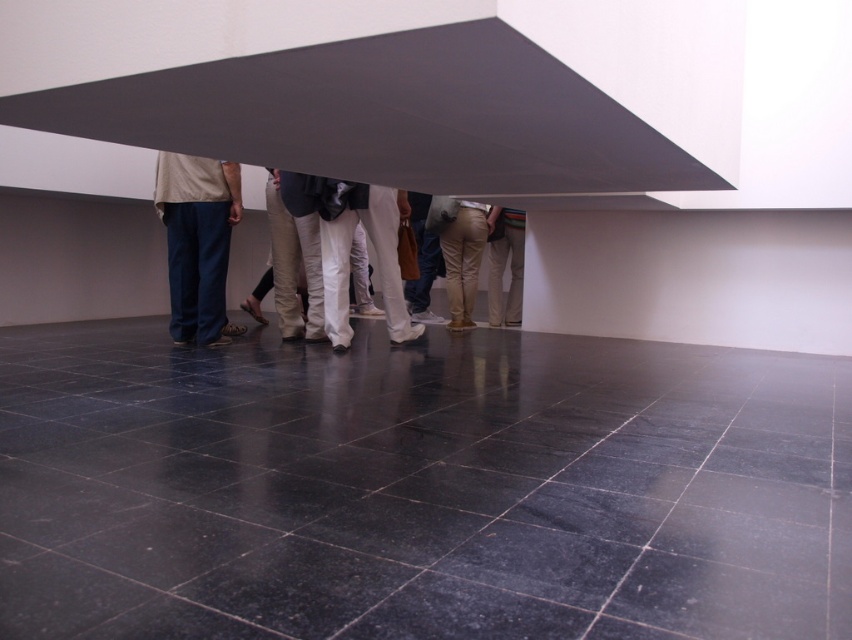
The height and width of the screenshot is (640, 852). Describe the element at coordinates (459, 252) in the screenshot. I see `khaki pants at center` at that location.

Is point (440, 220) farther from viewer compared to point (490, 292)?

That is False.

Locate an element on the screen. The width and height of the screenshot is (852, 640). khaki pants at center is located at coordinates (459, 252).

Between denim pants at center and khaki cotton pants at center, which one is positioned lower?

Positioned lower is denim pants at center.

Between point (180, 285) and point (491, 253), which one is positioned in front?

Point (180, 285) is more forward.

Is point (222, 336) in front of point (521, 316)?

Yes.

Find the location of `denim pants at center`. denim pants at center is located at coordinates (196, 241).

Does denim pants at center come in front of khaki pants at center?

Yes, denim pants at center is in front of khaki pants at center.

Can you confirm if denim pants at center is thinner than khaki pants at center?

No, denim pants at center is not thinner than khaki pants at center.

Does point (225, 230) come farther from viewer compared to point (465, 221)?

No, (225, 230) is closer to viewer.

In order to click on denim pants at center in this screenshot , I will do `click(196, 241)`.